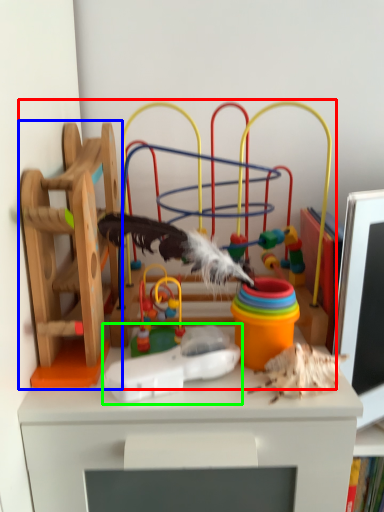
Question: Which object is the farthest from toy (highlighted by a red box)? Choose among these: toy (highlighted by a blue box) or toy (highlighted by a green box).

Choices:
 (A) toy
 (B) toy

Answer: (B)